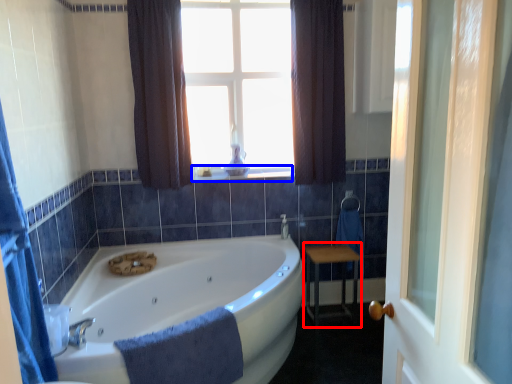
Question: Which object appears farthest to the camera in this image, table (highlighted by a red box) or window sill (highlighted by a blue box)?

Choices:
 (A) table
 (B) window sill

Answer: (B)